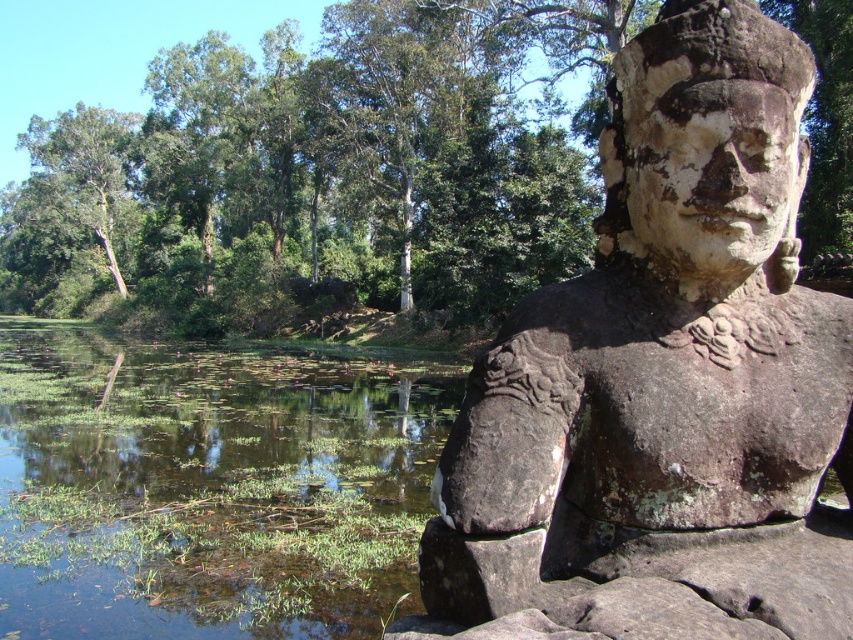
Question: Which point is farther to the camera?

Choices:
 (A) green leafy tree at upper left
 (B) green leafy tree at upper center
 (C) weathered stone statue at right

Answer: (A)

Question: Is green leafy tree at upper center wider than green grassy river at lower left?

Choices:
 (A) yes
 (B) no

Answer: (A)

Question: Does weathered stone statue at right have a larger size compared to green leafy tree at upper center?

Choices:
 (A) no
 (B) yes

Answer: (A)

Question: Which point is farther to the camera?

Choices:
 (A) (39, 152)
 (B) (96, 403)
 (C) (560, 6)

Answer: (A)

Question: Considering the relative positions of weathered stone statue at right and green leafy tree at upper left in the image provided, where is weathered stone statue at right located with respect to green leafy tree at upper left?

Choices:
 (A) above
 (B) below

Answer: (B)

Question: Which point is farther from the camera taking this photo?

Choices:
 (A) (567, 572)
 (B) (25, 198)

Answer: (B)